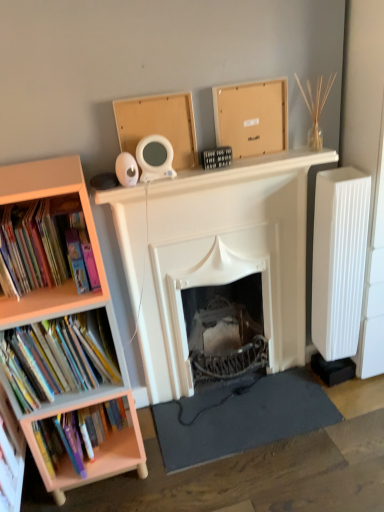
Identify the location of free spot in front of dark gray rubber mat at lower center. (259, 477).